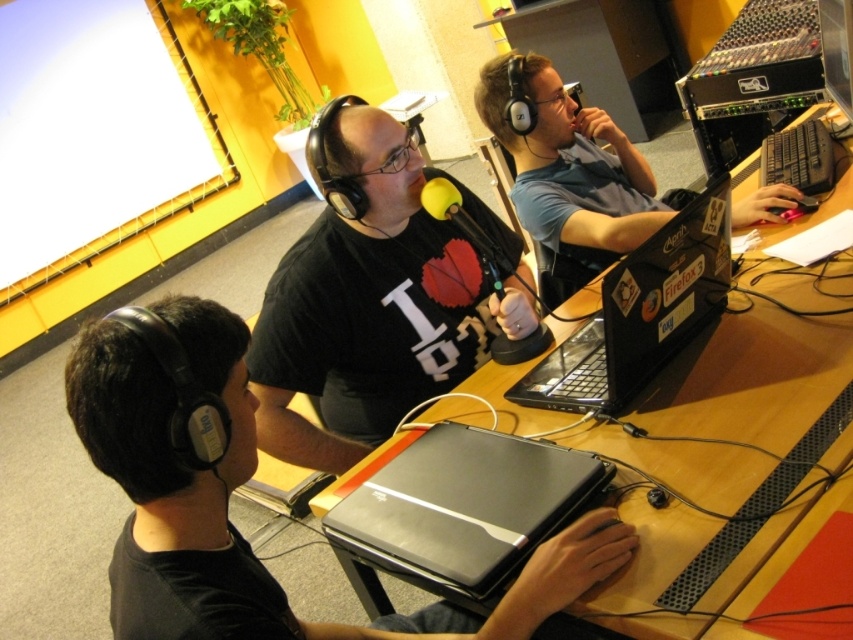
You are setting up a microphone stand in the radio studio. The microphone stand requires a space of 1 meter in width. You have two options to place it either on the black plastic table at center or the matte black laptop at right. Which surface can accommodate the microphone stand based on their widths?

The black plastic table at center has a larger width than the matte black laptop at right, so the microphone stand should be placed on the black plastic table at center to accommodate its 1 meter width requirement.

You are a technician who needs to place a 7 inch wide cable between the black plastic table at center and the black glossy laptop at center. Can you fit it there?

The black plastic table at center and black glossy laptop at center are 6.79 inches apart from each other. Since the cable is 7 inches wide, it cannot fit between them.